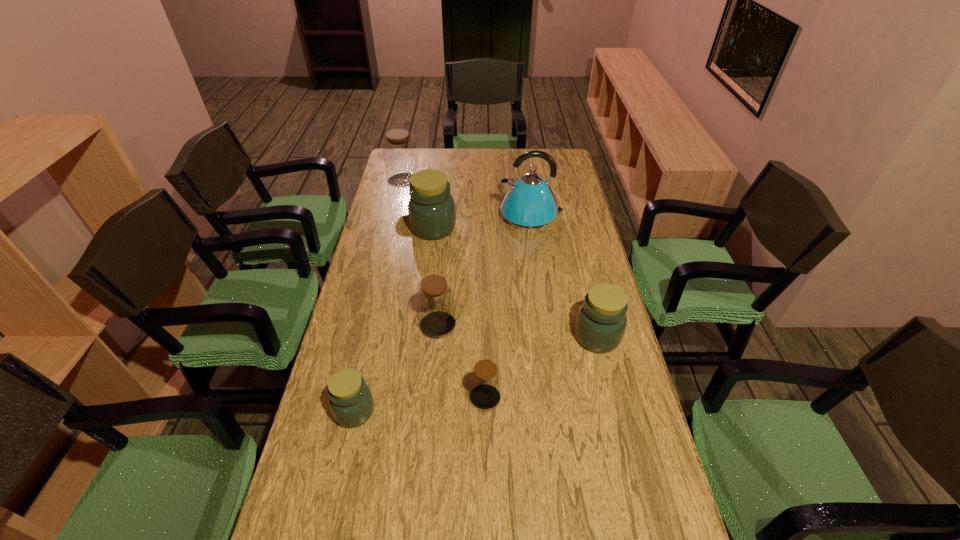
Where is `vacant space located on the left of the rightmost brown jar`? Image resolution: width=960 pixels, height=540 pixels. vacant space located on the left of the rightmost brown jar is located at coordinates (332, 398).

Locate an element on the screen. This screenshot has height=540, width=960. free region located 0.330m on the right of the smallest green jar is located at coordinates (500, 411).

The width and height of the screenshot is (960, 540). In order to click on object located in the far edge section of the desktop in this screenshot , I will do `click(400, 156)`.

Image resolution: width=960 pixels, height=540 pixels. In order to click on kettle located at the right edge in this screenshot , I will do `click(529, 204)`.

The width and height of the screenshot is (960, 540). I want to click on jar that is at the right edge, so click(x=600, y=325).

You are a GUI agent. You are given a task and a screenshot of the screen. Output one action in this format:
    pyautogui.click(x=<x>, y=<y>)
    Task: Click on the object that is at the far left corner
    The image size is (960, 540).
    Given the screenshot: What is the action you would take?
    pyautogui.click(x=400, y=156)

Locate an element on the screen. The image size is (960, 540). free space at the far edge of the desktop is located at coordinates (472, 151).

Where is `blank space at the left edge of the desktop`? The width and height of the screenshot is (960, 540). blank space at the left edge of the desktop is located at coordinates (381, 312).

The width and height of the screenshot is (960, 540). I want to click on free space at the right edge of the desktop, so click(675, 532).

At what (x,y) coordinates should I click in order to perform the action: click on vacant area between the second brown jar from left to right and the nearest green jar. Please return your answer as a coordinate pair (x, y). Looking at the image, I should click on (396, 368).